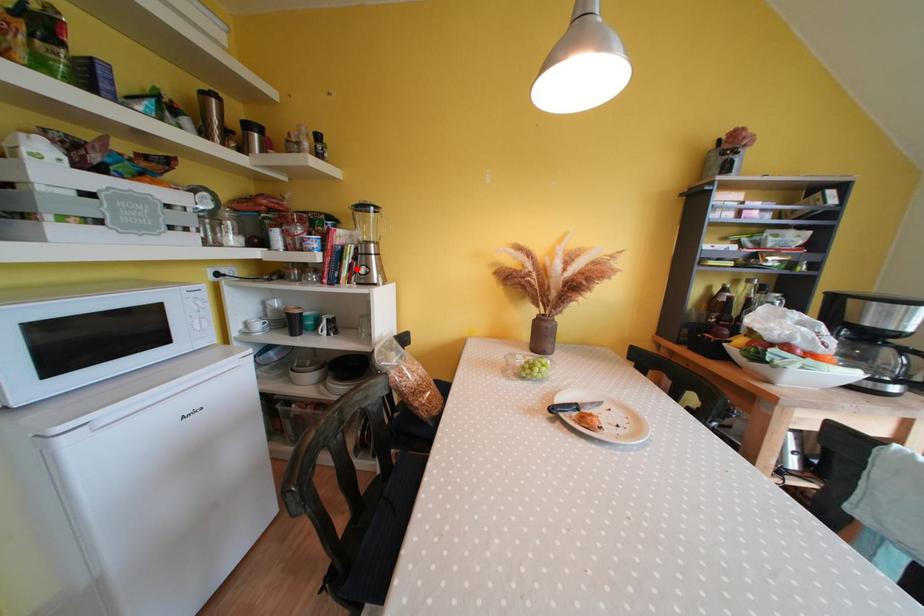
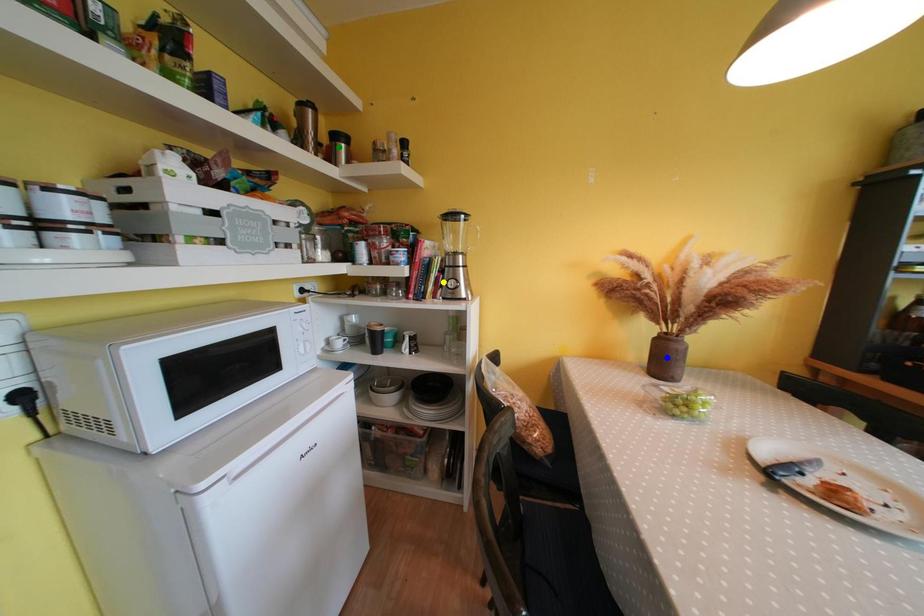
Question: I am providing you with two images of the same scene from different viewpoints. A red point is marked on the first image. You are given multiple points on the second image. In image 2, which mark is for the same physical point as the one in image 1?

Choices:
 (A) blue point
 (B) yellow point
 (C) green point

Answer: (B)